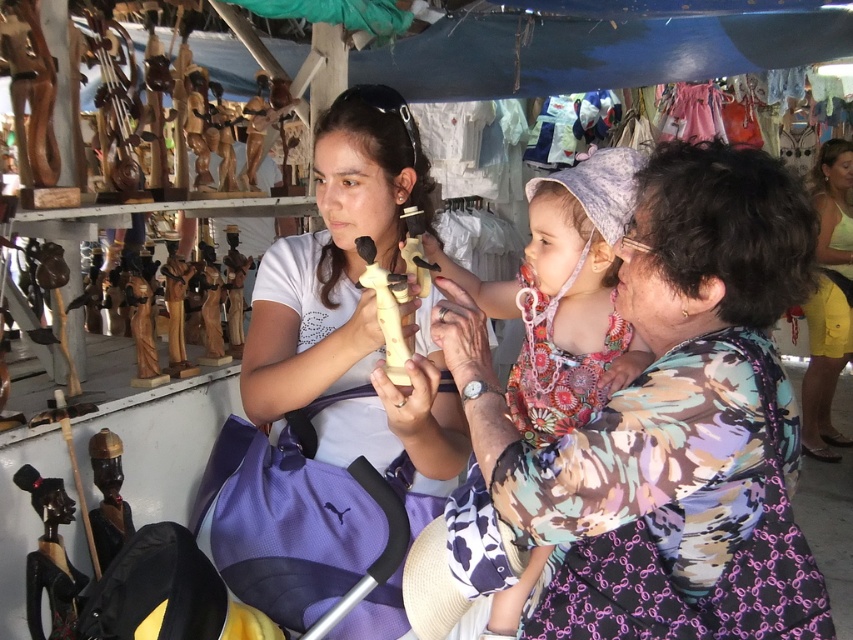
Is floral print dress at center shorter than yellow cotton shorts at lower right?

Yes.

Describe the element at coordinates (672, 420) in the screenshot. I see `floral print dress at center` at that location.

Identify the location of floral print dress at center. (672, 420).

Measure the distance between point (277, 424) and camera.

Point (277, 424) is 4.79 feet away from camera.

Measure the distance between matte white statue at center and camera.

A distance of 1.08 meters exists between matte white statue at center and camera.

Who is more forward, (338, 353) or (814, 316)?

Point (338, 353)

What are the coordinates of `matte white statue at center` in the screenshot? It's located at (352, 300).

Is yellow cotton shorts at lower right closer to camera compared to wooden figurine at lower left?

No, yellow cotton shorts at lower right is further to the viewer.

Can you confirm if yellow cotton shorts at lower right is bigger than wooden figurine at lower left?

Yes.

Identify the location of yellow cotton shorts at lower right. This screenshot has width=853, height=640. (824, 368).